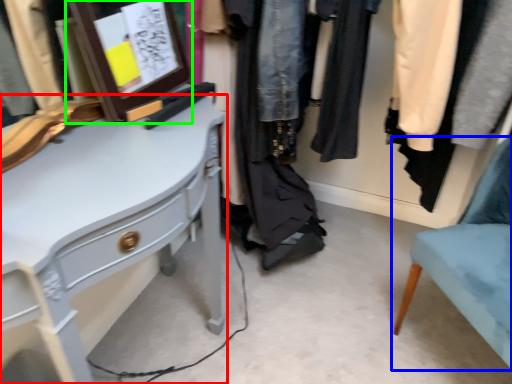
Question: Considering the real-world distances, which object is closest to desk (highlighted by a red box)? chair (highlighted by a blue box) or picture frame (highlighted by a green box).

Choices:
 (A) chair
 (B) picture frame

Answer: (B)